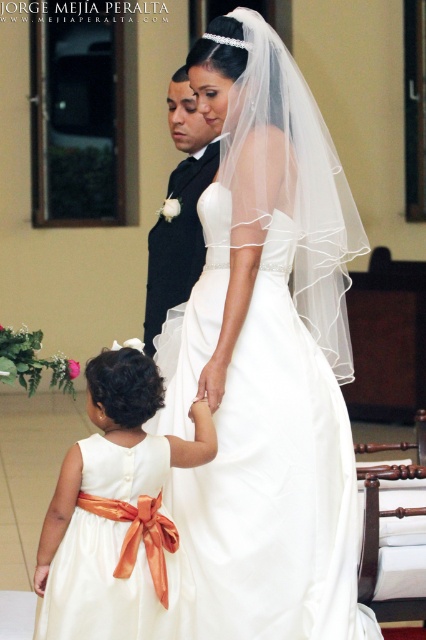
Question: Is white satin dress at lower left closer to the viewer compared to black satin suit at center?

Choices:
 (A) yes
 (B) no

Answer: (A)

Question: Which object appears closest to the camera in this image?

Choices:
 (A) white satin dress at lower left
 (B) black satin suit at center

Answer: (A)

Question: Which point is farther to the camera?

Choices:
 (A) black satin suit at center
 (B) white satin dress at lower left
 (C) white satin dress at center

Answer: (A)

Question: Can you confirm if white satin dress at center is positioned to the right of white satin dress at lower left?

Choices:
 (A) no
 (B) yes

Answer: (B)

Question: Is white satin dress at lower left to the left of black satin suit at center from the viewer's perspective?

Choices:
 (A) no
 (B) yes

Answer: (B)

Question: Based on their relative distances, which object is nearer to the white satin dress at center?

Choices:
 (A) white satin dress at lower left
 (B) black satin suit at center

Answer: (A)